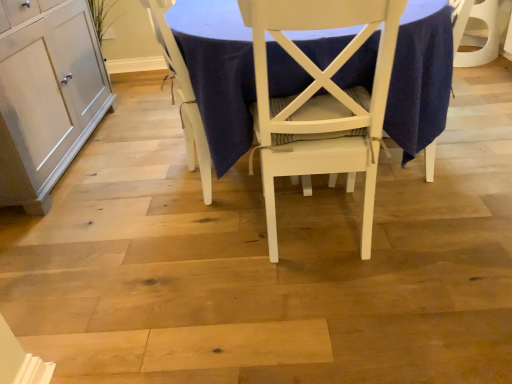
How much space does white wood chair at center, arranged as the 1th chair when viewed from the left, occupy horizontally?

It is 40.19 centimeters.

This screenshot has height=384, width=512. Describe the element at coordinates (321, 99) in the screenshot. I see `white painted wood chair at center, the second chair in the left-to-right sequence` at that location.

What do you see at coordinates (46, 95) in the screenshot? The image size is (512, 384). I see `matte white cabinet at left` at bounding box center [46, 95].

Identify the location of white wood table at center. Image resolution: width=512 pixels, height=384 pixels. (218, 73).

Is white painted wood chair at center, which ranks as the 1th chair in right-to-left order, wider than white wood table at center?

Incorrect, the width of white painted wood chair at center, which ranks as the 1th chair in right-to-left order, does not surpass that of white wood table at center.

What's the angular difference between white painted wood chair at center, the second chair in the left-to-right sequence, and white wood table at center's facing directions?

175 degrees.

Which is closer, (x=390, y=63) or (x=215, y=0)?

Point (x=390, y=63) is positioned closer to the camera compared to point (x=215, y=0).

Which is more to the left, white painted wood chair at center, the second chair in the left-to-right sequence, or white wood table at center?

Positioned to the left is white painted wood chair at center, the second chair in the left-to-right sequence.

Is matte white cabinet at left outside of white painted wood chair at center, which ranks as the 1th chair in right-to-left order?

Indeed, matte white cabinet at left is completely outside white painted wood chair at center, which ranks as the 1th chair in right-to-left order.

Based on their positions, is matte white cabinet at left located to the left or right of white painted wood chair at center, the second chair in the left-to-right sequence?

matte white cabinet at left is positioned on white painted wood chair at center, the second chair in the left-to-right sequence,'s left side.

Looking at this image, considering the relative sizes of matte white cabinet at left and white painted wood chair at center, the second chair in the left-to-right sequence, in the image provided, is matte white cabinet at left shorter than white painted wood chair at center, the second chair in the left-to-right sequence,?

Yes.

From a real-world perspective, is matte white cabinet at left located higher than white painted wood chair at center, which ranks as the 1th chair in right-to-left order?

No, from a real-world perspective, matte white cabinet at left is not above white painted wood chair at center, which ranks as the 1th chair in right-to-left order.

Which of these two, matte white cabinet at left or white wood chair at center, the second chair from the right, stands shorter?

matte white cabinet at left is shorter.

Is matte white cabinet at left at the right side of white wood chair at center, the second chair from the right?

No, matte white cabinet at left is not to the right of white wood chair at center, the second chair from the right.

How different are the orientations of matte white cabinet at left and white wood chair at center, arranged as the 1th chair when viewed from the left, in degrees?

The facing directions of matte white cabinet at left and white wood chair at center, arranged as the 1th chair when viewed from the left, are 14.5 degrees apart.

From the image's perspective, is matte white cabinet at left on white wood chair at center, the second chair from the right?

Yes, from the image's perspective, matte white cabinet at left is over white wood chair at center, the second chair from the right.

From a real-world perspective, between white wood chair at center, the second chair from the right, and matte white cabinet at left, who is vertically higher?

From a 3D spatial view, matte white cabinet at left is above.

The width and height of the screenshot is (512, 384). What are the coordinates of `cabinetry lying on the left of white wood chair at center, the second chair from the right` in the screenshot? It's located at (46, 95).

Who is smaller, white wood chair at center, the second chair from the right, or matte white cabinet at left?

With smaller size is white wood chair at center, the second chair from the right.

Is matte white cabinet at left surrounded by white wood chair at center, the second chair from the right?

Definitely not — matte white cabinet at left is not inside white wood chair at center, the second chair from the right.

From a real-world perspective, does white painted wood chair at center, the second chair in the left-to-right sequence, stand above white wood chair at center, the second chair from the right?

Yes, from a real-world perspective, white painted wood chair at center, the second chair in the left-to-right sequence, is over white wood chair at center, the second chair from the right

Does point (360, 116) appear closer or farther from the camera than point (160, 0)?

Point (360, 116) is positioned closer to the camera compared to point (160, 0).

Considering the relative sizes of white painted wood chair at center, which ranks as the 1th chair in right-to-left order, and white wood chair at center, the second chair from the right, in the image provided, is white painted wood chair at center, which ranks as the 1th chair in right-to-left order, bigger than white wood chair at center, the second chair from the right,?

Yes, white painted wood chair at center, which ranks as the 1th chair in right-to-left order, is bigger than white wood chair at center, the second chair from the right.

Is the depth of white wood table at center less than that of matte white cabinet at left?

That is True.

Considering the sizes of white wood table at center and matte white cabinet at left in the image, is white wood table at center wider or thinner than matte white cabinet at left?

Clearly, white wood table at center has more width compared to matte white cabinet at left.

Looking at the image, does white wood table at center seem bigger or smaller compared to matte white cabinet at left?

In the image, white wood table at center appears to be larger than matte white cabinet at left.

Considering the positions of point (313, 59) and point (24, 0), is point (313, 59) closer or farther from the camera than point (24, 0)?

Point (313, 59) is positioned closer to the camera compared to point (24, 0).

Is white wood chair at center, the second chair from the right, next to white painted wood chair at center, which ranks as the 1th chair in right-to-left order?

No, white wood chair at center, the second chair from the right, is not in contact with white painted wood chair at center, which ranks as the 1th chair in right-to-left order.

Looking at the image, does white wood chair at center, arranged as the 1th chair when viewed from the left, seem bigger or smaller compared to white painted wood chair at center, which ranks as the 1th chair in right-to-left order?

Considering their sizes, white wood chair at center, arranged as the 1th chair when viewed from the left, takes up less space than white painted wood chair at center, which ranks as the 1th chair in right-to-left order.

Would you say white painted wood chair at center, the second chair in the left-to-right sequence, is part of white wood chair at center, arranged as the 1th chair when viewed from the left,'s contents?

No.

This screenshot has height=384, width=512. Identify the location of chair that appears above the white wood table at center (from a real-world perspective). (321, 99).

Where is `cabinetry located above the white painted wood chair at center, which ranks as the 1th chair in right-to-left order (from the image's perspective)`? The height and width of the screenshot is (384, 512). cabinetry located above the white painted wood chair at center, which ranks as the 1th chair in right-to-left order (from the image's perspective) is located at coordinates (46, 95).

Looking at the image, which one is located further to white wood table at center, white painted wood chair at center, the second chair in the left-to-right sequence, or white wood chair at center, the second chair from the right?

white wood chair at center, the second chair from the right, is further to white wood table at center.

From the image, which object appears to be farther from white painted wood chair at center, which ranks as the 1th chair in right-to-left order, white wood table at center or white wood chair at center, the second chair from the right?

white wood chair at center, the second chair from the right, is further to white painted wood chair at center, which ranks as the 1th chair in right-to-left order.

Which object lies further to the anchor point white wood chair at center, the second chair from the right, matte white cabinet at left or white painted wood chair at center, which ranks as the 1th chair in right-to-left order?

matte white cabinet at left.

Estimate the real-world distances between objects in this image. Which object is closer to white painted wood chair at center, which ranks as the 1th chair in right-to-left order, white wood chair at center, arranged as the 1th chair when viewed from the left, or white wood table at center?

white wood table at center is closer to white painted wood chair at center, which ranks as the 1th chair in right-to-left order.

Looking at the image, which one is located further to white wood chair at center, the second chair from the right, white wood table at center or white painted wood chair at center, the second chair in the left-to-right sequence?

Among the two, white painted wood chair at center, the second chair in the left-to-right sequence, is located further to white wood chair at center, the second chair from the right.

From the picture: Based on their spatial positions, is matte white cabinet at left or white wood table at center closer to white wood chair at center, the second chair from the right?

Among the two, white wood table at center is located nearer to white wood chair at center, the second chair from the right.

Which object lies nearer to the anchor point white painted wood chair at center, the second chair in the left-to-right sequence, white wood chair at center, arranged as the 1th chair when viewed from the left, or matte white cabinet at left?

Based on the image, white wood chair at center, arranged as the 1th chair when viewed from the left, appears to be nearer to white painted wood chair at center, the second chair in the left-to-right sequence.

Considering their positions, is white wood table at center positioned further to white wood chair at center, arranged as the 1th chair when viewed from the left, than matte white cabinet at left?

matte white cabinet at left is positioned further to the anchor white wood chair at center, arranged as the 1th chair when viewed from the left.

You are a GUI agent. You are given a task and a screenshot of the screen. Output one action in this format:
    pyautogui.click(x=<x>, y=<y>)
    Task: Click on the chair located between matte white cabinet at left and white painted wood chair at center, which ranks as the 1th chair in right-to-left order, in the left-right direction
    Image resolution: width=512 pixels, height=384 pixels.
    Given the screenshot: What is the action you would take?
    tap(183, 95)

Identify the location of chair between white wood chair at center, arranged as the 1th chair when viewed from the left, and white wood table at center from left to right. The image size is (512, 384). (321, 99).